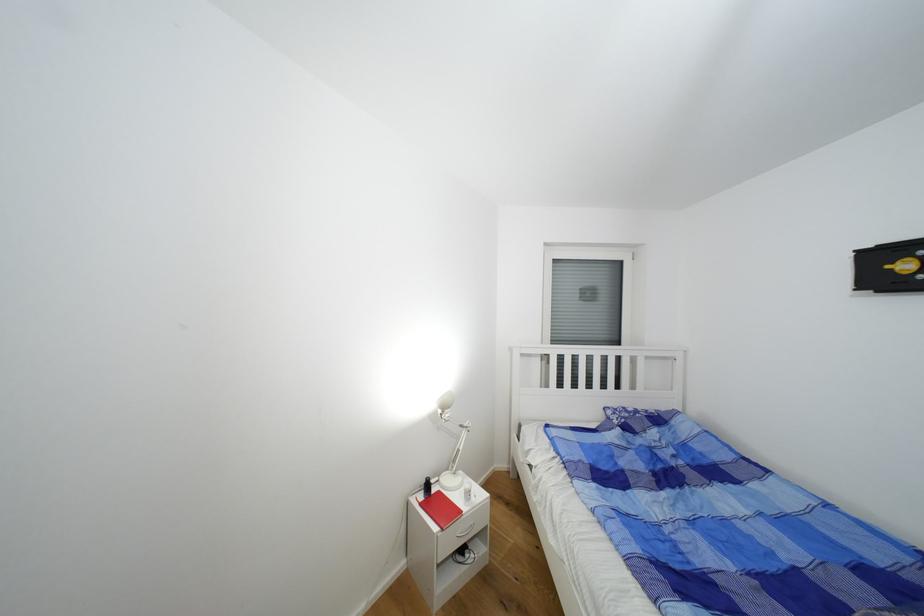
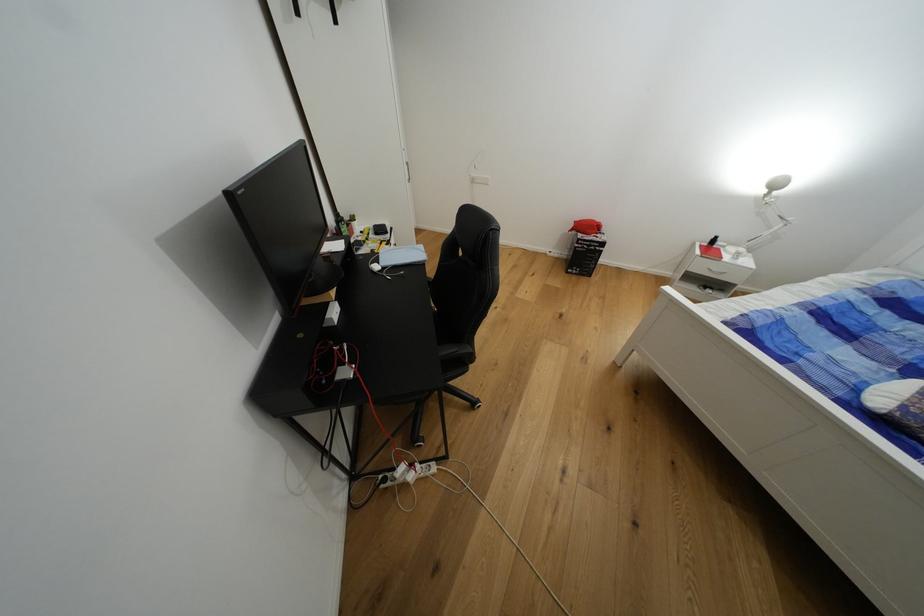
Find the pixel in the second image that matches (444,413) in the first image.

(771, 193)